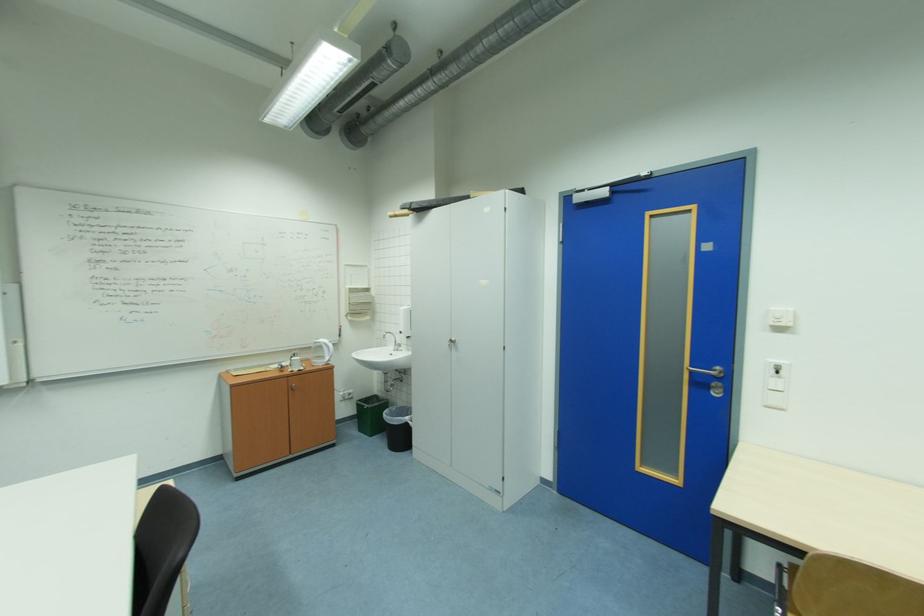
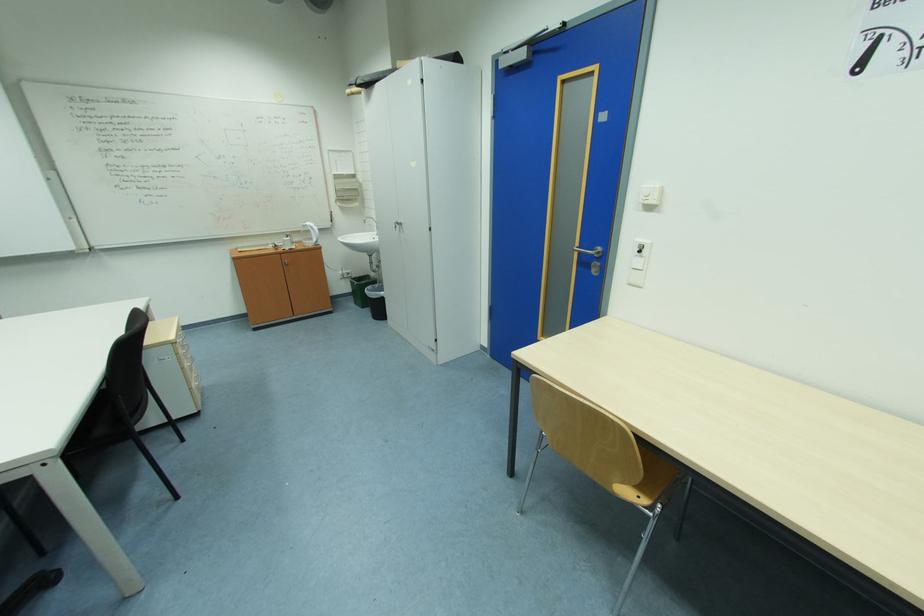
In the second image, find the point that corresponds to (x=775, y=408) in the first image.

(638, 286)